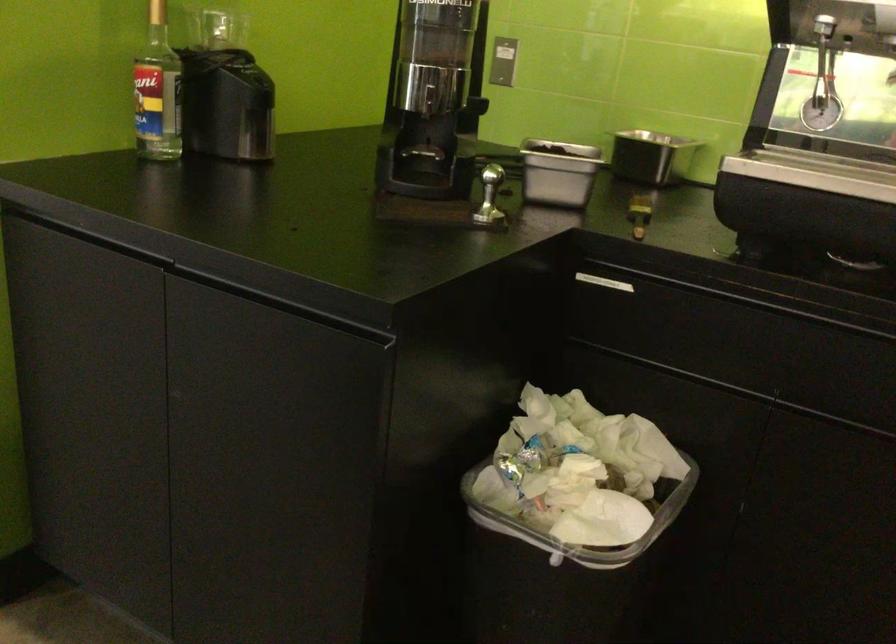
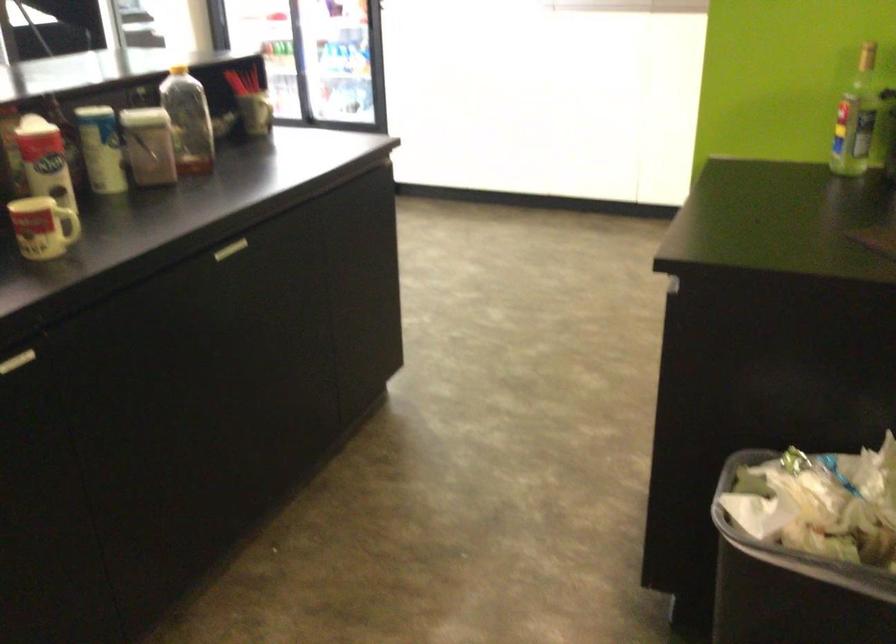
The point at (204,105) is marked in the first image. Where is the corresponding point in the second image?

(856, 118)